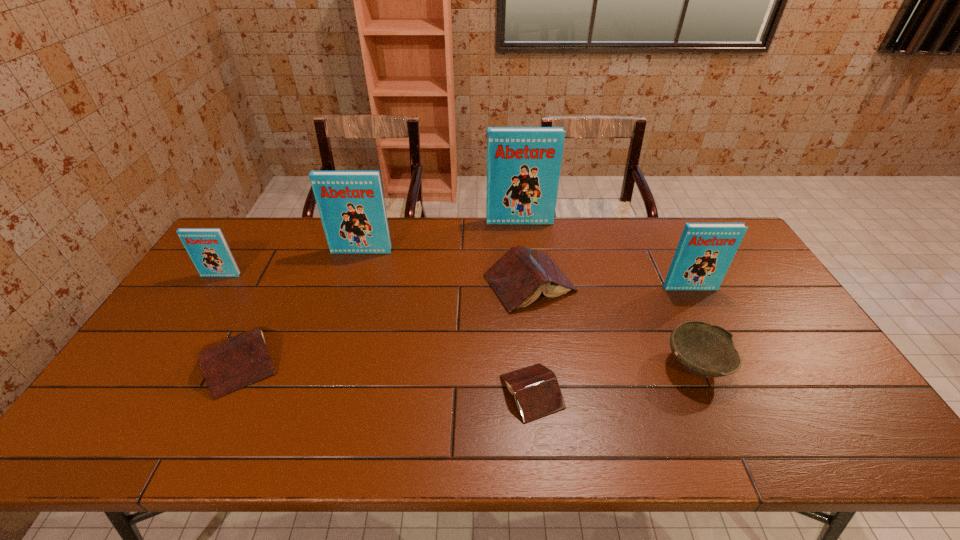
You are a GUI agent. You are given a task and a screenshot of the screen. Output one action in this format:
    pyautogui.click(x=<x>, y=<y>)
    Task: Click on the second closest blue book to the second tallest book
    Image resolution: width=960 pixels, height=540 pixels.
    Given the screenshot: What is the action you would take?
    pyautogui.click(x=523, y=163)

You are a GUI agent. You are given a task and a screenshot of the screen. Output one action in this format:
    pyautogui.click(x=<x>, y=<y>)
    Task: Click on the blue book that is the second closest to the shortest object
    
    Given the screenshot: What is the action you would take?
    pyautogui.click(x=351, y=205)

Locate an element on the screen. This screenshot has width=960, height=540. brown book that stands as the second closest to the farthest brown book is located at coordinates (232, 363).

Locate an element on the screen. The height and width of the screenshot is (540, 960). brown book that is the second nearest to the bowl is located at coordinates (537, 393).

The width and height of the screenshot is (960, 540). I want to click on vacant space that satisfies the following two spatial constraints: 1. on the front cover of the second blue book from right to left; 2. on the left side of the bowl, so click(x=536, y=364).

At what (x,y) coordinates should I click in order to perform the action: click on vacant position in the image that satisfies the following two spatial constraints: 1. on the front cover of the fifth tallest book; 2. on the right side of the third nearest blue book. Please return your answer as a coordinate pair (x, y). The image size is (960, 540). Looking at the image, I should click on (351, 284).

Where is `blank space that satisfies the following two spatial constraints: 1. on the front cover of the bowl; 2. on the left side of the third smallest blue book`? The image size is (960, 540). blank space that satisfies the following two spatial constraints: 1. on the front cover of the bowl; 2. on the left side of the third smallest blue book is located at coordinates (325, 364).

I want to click on free spot that satisfies the following two spatial constraints: 1. on the front cover of the fifth tallest book; 2. on the left side of the second tallest book, so click(x=351, y=284).

The width and height of the screenshot is (960, 540). What are the coordinates of `free space that satisfies the following two spatial constraints: 1. on the front cover of the leftmost blue book; 2. on the left side of the bowl` in the screenshot? It's located at (163, 364).

Where is `blank area in the image that satisfies the following two spatial constraints: 1. on the back side of the shortest book; 2. on the right side of the biggest brown book`? This screenshot has width=960, height=540. blank area in the image that satisfies the following two spatial constraints: 1. on the back side of the shortest book; 2. on the right side of the biggest brown book is located at coordinates (521, 284).